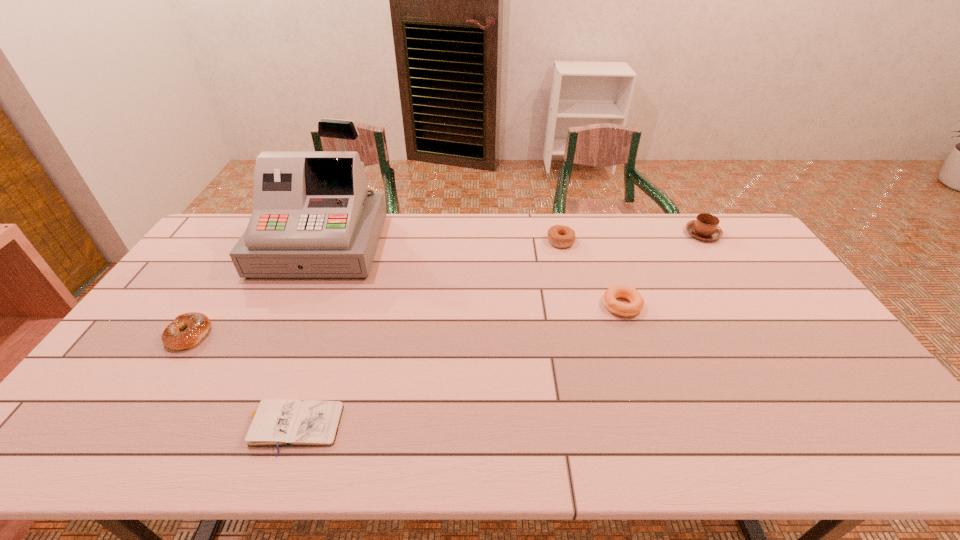
Locate an element on the screen. The height and width of the screenshot is (540, 960). the tallest object is located at coordinates 313,217.

I want to click on the rightmost object, so click(x=705, y=227).

Find the location of `cappuccino`. cappuccino is located at coordinates (705, 227).

Identify the location of the fourth object from left to right. point(559,236).

The width and height of the screenshot is (960, 540). Find the location of `the farthest bagel`. the farthest bagel is located at coordinates (559, 236).

This screenshot has height=540, width=960. I want to click on the rightmost bagel, so pyautogui.click(x=636, y=304).

I want to click on the leftmost bagel, so tap(197, 325).

Identify the location of the shortest object. The width and height of the screenshot is (960, 540). (273, 422).

The image size is (960, 540). What are the coordinates of `the nearest object` in the screenshot? It's located at (273, 422).

This screenshot has height=540, width=960. I want to click on vacant space located on the keypad side of the tallest object, so click(292, 309).